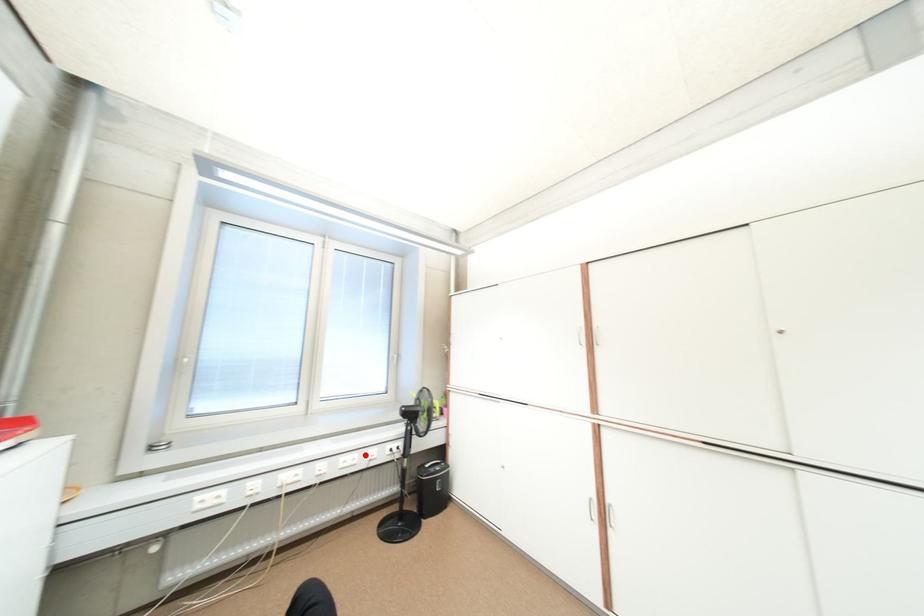
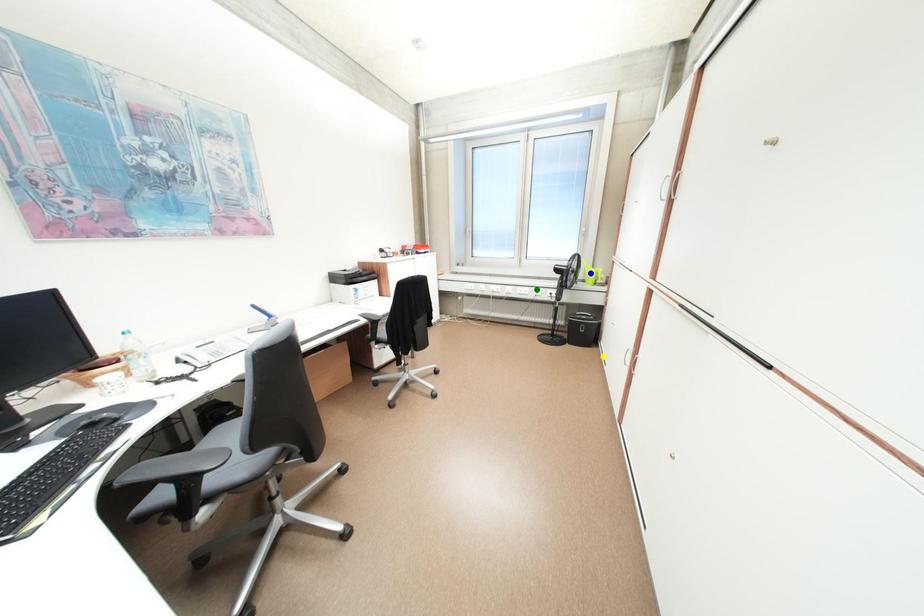
Question: I am providing you with two images of the same scene from different viewpoints. A red point is marked on the first image. You are given multiple points on the second image. Can you choose the point in image 2 that corresponds to the point in image 1?

Choices:
 (A) yellow point
 (B) green point
 (C) blue point

Answer: (B)